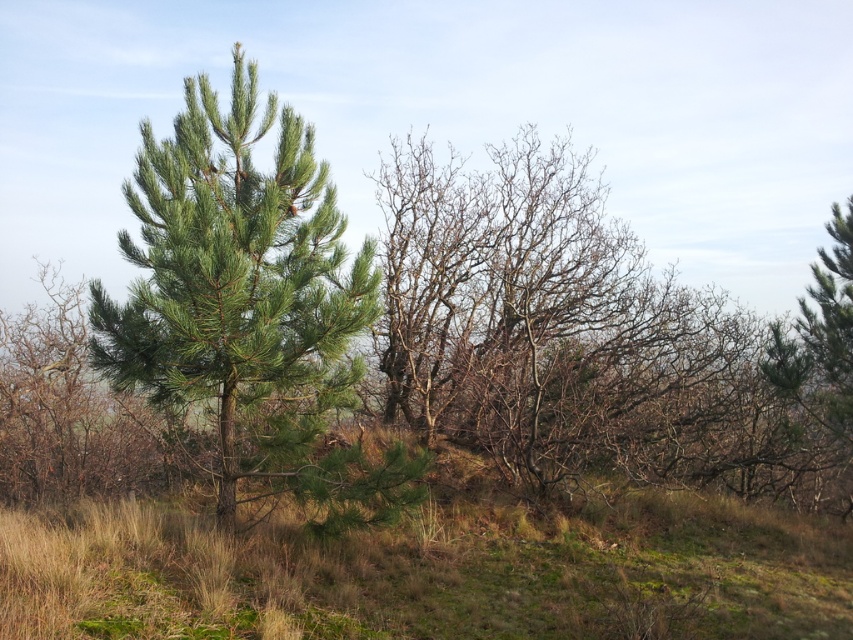
Question: Which point is farther from the camera taking this photo?

Choices:
 (A) (341, 218)
 (B) (584, 243)

Answer: (B)

Question: Does green needle-like at center lie in front of green needle-like at right?

Choices:
 (A) yes
 (B) no

Answer: (A)

Question: Is bare branches at center thinner than green needle-like at right?

Choices:
 (A) no
 (B) yes

Answer: (B)

Question: Which point is farther to the camera?

Choices:
 (A) (838, 268)
 (B) (624, 342)
 (C) (296, 246)

Answer: (A)

Question: Which of the following is the closest to the observer?

Choices:
 (A) (239, 349)
 (B) (490, 262)

Answer: (A)

Question: From the image, what is the correct spatial relationship of green needle-like at center in relation to green needle-like at right?

Choices:
 (A) right
 (B) left

Answer: (B)